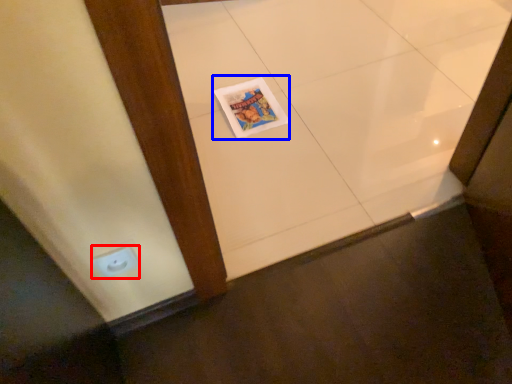
Question: Which object appears farthest to the camera in this image, electric outlet (highlighted by a red box) or magazine (highlighted by a blue box)?

Choices:
 (A) electric outlet
 (B) magazine

Answer: (B)